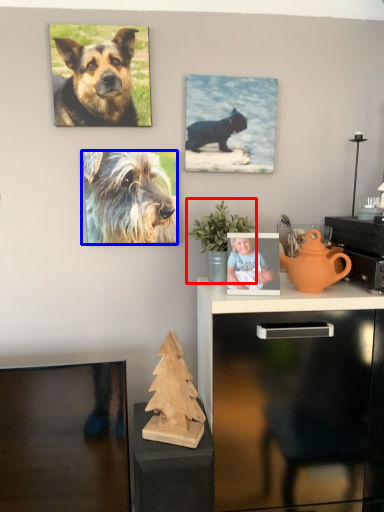
Question: Which point is closer to the camera, houseplant (highlighted by a red box) or dog (highlighted by a blue box)?

Choices:
 (A) houseplant
 (B) dog

Answer: (A)